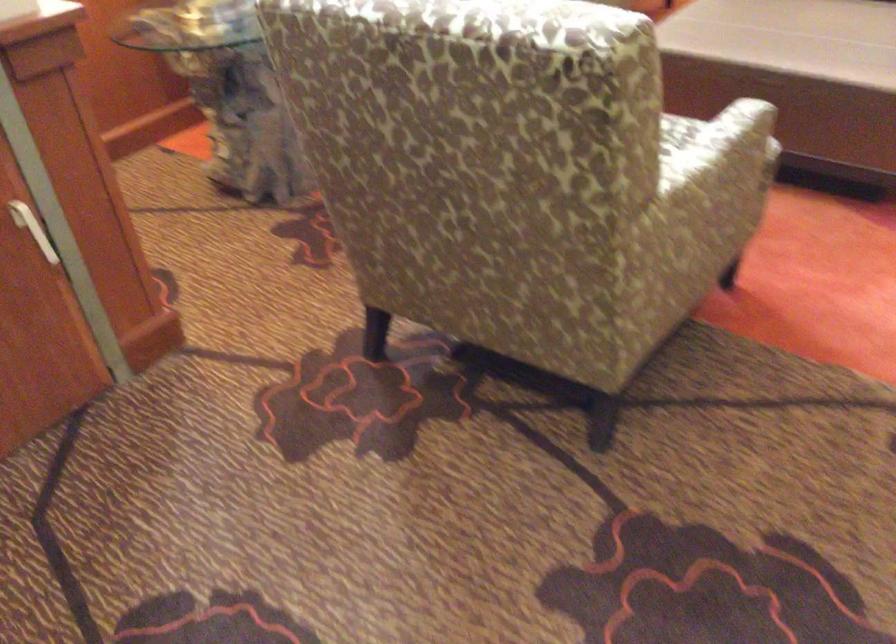
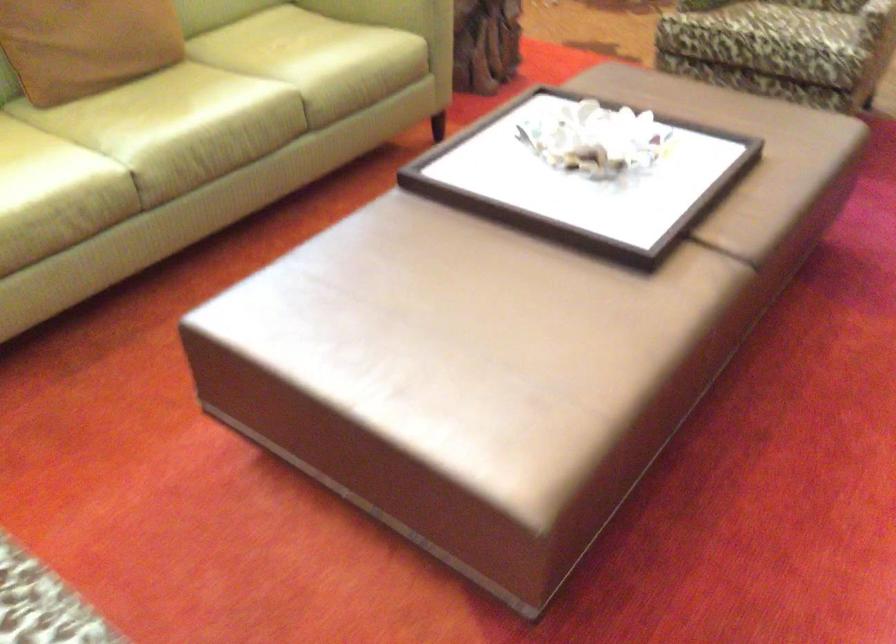
What movement of the cameraman would produce the second image?

The movement direction of the cameraman is right, forward.